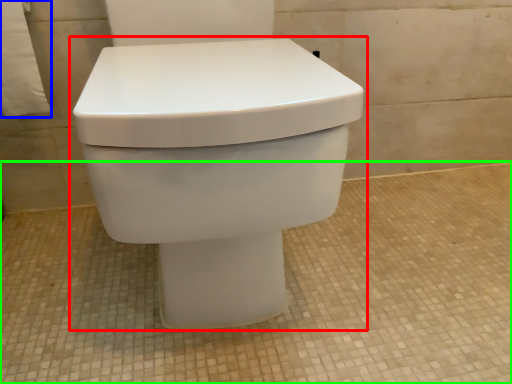
Question: Which object is the closest to the toilet (highlighted by a red box)? Choose among these: toilet paper (highlighted by a blue box) or concrete (highlighted by a green box).

Choices:
 (A) toilet paper
 (B) concrete

Answer: (B)